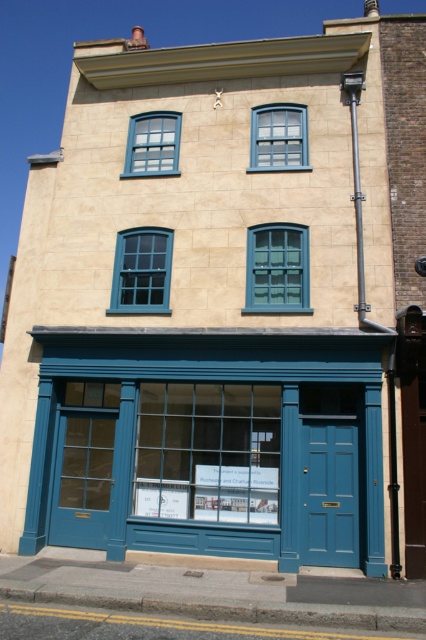
Is clear glass window at center further to the viewer compared to matte blue window at upper center?

No, it is in front of matte blue window at upper center.

Is point (268, 518) more distant than point (252, 132)?

No, (268, 518) is in front of (252, 132).

Does point (273, 467) come in front of point (294, 157)?

That is True.

Where is `clear glass window at center`? The height and width of the screenshot is (640, 426). clear glass window at center is located at coordinates (207, 451).

Which is behind, point (124, 250) or point (281, 136)?

Point (281, 136)

Does matte teal glass window at center have a greater width compared to matte blue window at upper center?

Yes, matte teal glass window at center is wider than matte blue window at upper center.

At what (x,y) coordinates should I click in order to perform the action: click on matte teal glass window at center. Please return your answer as a coordinate pair (x, y). Looking at the image, I should click on (141, 272).

Measure the distance between matte blue storefront at center and clear glass window at center.

A distance of 2.80 meters exists between matte blue storefront at center and clear glass window at center.

Consider the image. Can you confirm if matte blue storefront at center is taller than clear glass window at center?

Incorrect, matte blue storefront at center's height is not larger of clear glass window at center's.

Does point (51, 369) come behind point (262, 390)?

Yes, it is behind point (262, 390).

The height and width of the screenshot is (640, 426). What are the coordinates of `matte blue storefront at center` in the screenshot? It's located at (189, 413).